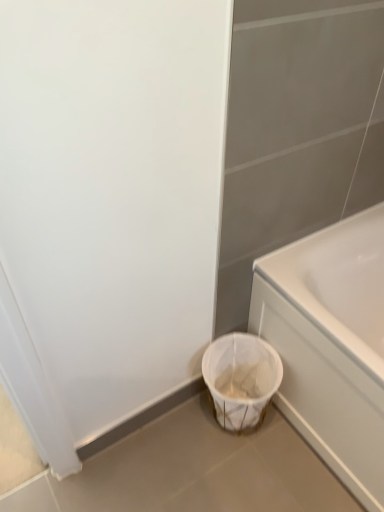
Question: In terms of height, does white glossy bathtub at lower right look taller or shorter compared to white woven laundry basket at lower center?

Choices:
 (A) tall
 (B) short

Answer: (A)

Question: Based on their sizes in the image, would you say white glossy bathtub at lower right is bigger or smaller than white woven laundry basket at lower center?

Choices:
 (A) small
 (B) big

Answer: (B)

Question: Considering the positions of white glossy bathtub at lower right and white woven laundry basket at lower center in the image, is white glossy bathtub at lower right wider or thinner than white woven laundry basket at lower center?

Choices:
 (A) thin
 (B) wide

Answer: (B)

Question: Is white woven laundry basket at lower center wider or thinner than white glossy bathtub at lower right?

Choices:
 (A) wide
 (B) thin

Answer: (B)

Question: In terms of height, does white woven laundry basket at lower center look taller or shorter compared to white glossy bathtub at lower right?

Choices:
 (A) short
 (B) tall

Answer: (A)

Question: From a real-world perspective, relative to white glossy bathtub at lower right, is white woven laundry basket at lower center vertically above or below?

Choices:
 (A) above
 (B) below

Answer: (B)

Question: Is white woven laundry basket at lower center in front of or behind white glossy bathtub at lower right in the image?

Choices:
 (A) behind
 (B) front

Answer: (A)